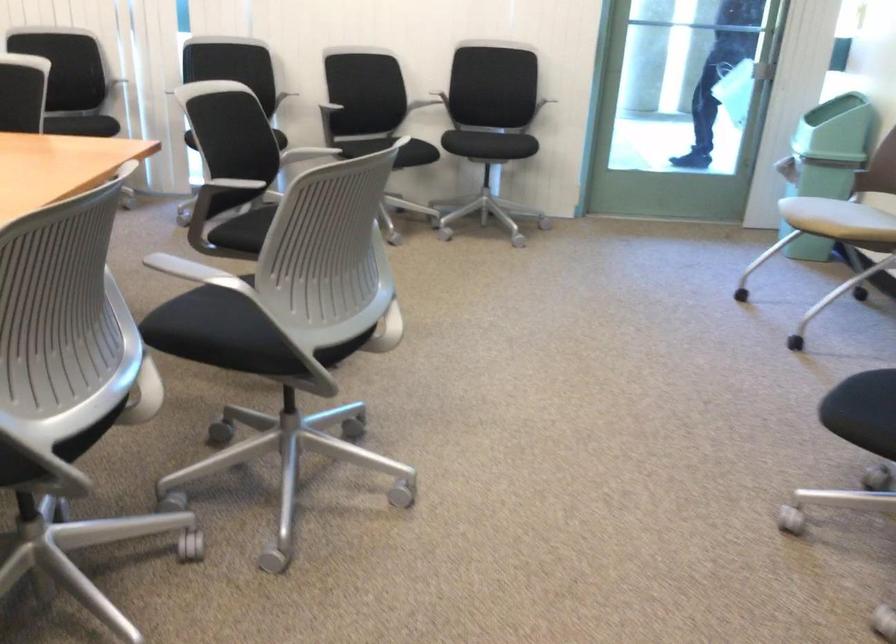
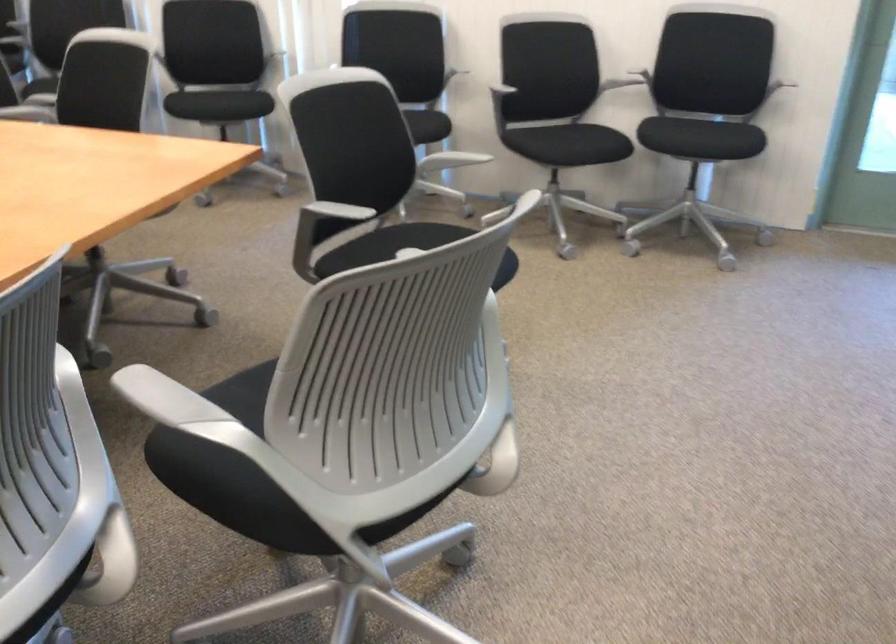
In the second image, find the point that corresponds to the point at 402,146 in the first image.

(579, 144)